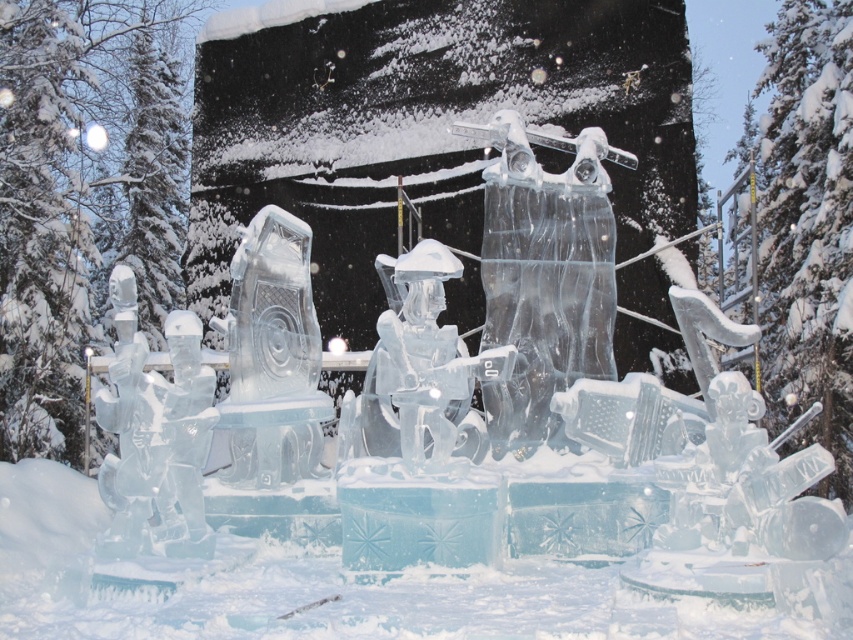
Does transparent ice snow at center have a lesser height compared to transparent ice figure at center?

In fact, transparent ice snow at center may be taller than transparent ice figure at center.

Is transparent ice snow at center bigger than transparent ice figure at center?

Indeed, transparent ice snow at center has a larger size compared to transparent ice figure at center.

Is point (50, 477) closer to camera compared to point (473, 380)?

No, (50, 477) is behind (473, 380).

At what (x,y) coordinates should I click in order to perform the action: click on transparent ice snow at center. Please return your answer as a coordinate pair (x, y). This screenshot has height=640, width=853. Looking at the image, I should click on click(343, 588).

Where is `clear ice harp at center`? clear ice harp at center is located at coordinates (544, 275).

Looking at this image, does clear ice harp at center appear over transparent ice figure at center?

No, clear ice harp at center is not above transparent ice figure at center.

The image size is (853, 640). Find the location of `clear ice harp at center`. clear ice harp at center is located at coordinates [x=544, y=275].

Which is in front, point (602, 618) or point (527, 176)?

Point (602, 618) is more forward.

Is transparent ice snow at center smaller than clear ice harp at center?

No, transparent ice snow at center is not smaller than clear ice harp at center.

Measure the distance between transparent ice snow at center and camera.

They are 42.41 feet apart.

Where is `transparent ice snow at center`? transparent ice snow at center is located at coordinates (343, 588).